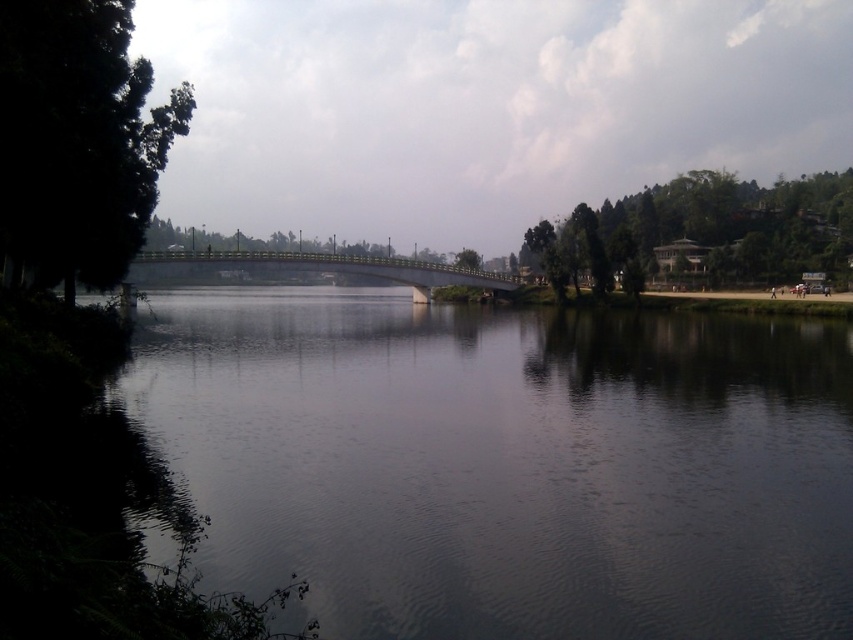
You are standing at the point with coordinates point (149, 259) and want to walk to the point with coordinates point (527, 236). Given that the bridge is in the midground, will the bridge block your path?

Point (527, 236) is behind point (149, 259), so the bridge will block your path to point (527, 236).

You are standing at the point marked by the coordinates (77,141) in the riverside scene. What object is exactly at that location?

The green leafy tree at left is located at point (77,141).